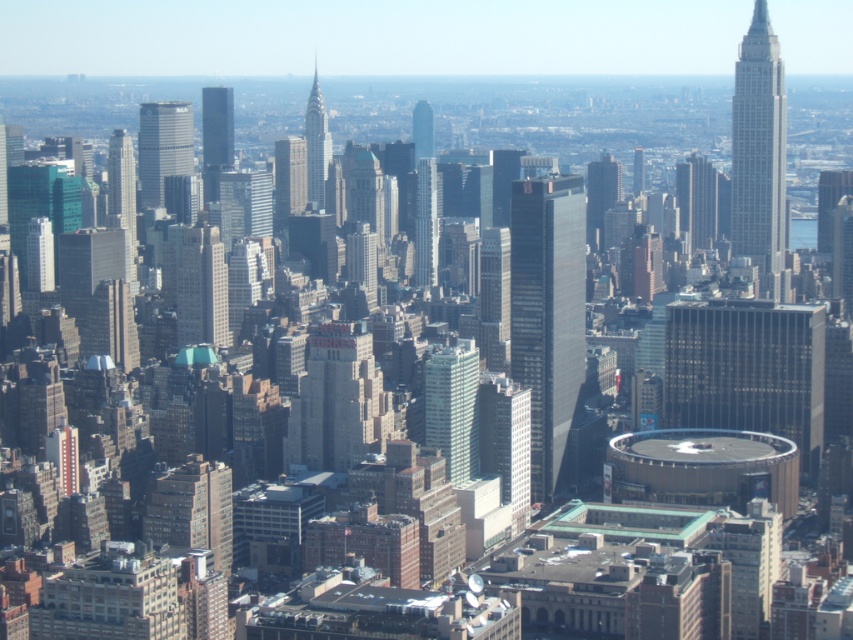
You are a drone operator planning to fly a drone from the green glass skyscraper at center to the shiny silver spire at center. Based on the cityscape view, which direction should you fly the drone to reach the spire?

The green glass skyscraper at center is in front of the shiny silver spire at center, so you should fly the drone backward to reach the shiny silver spire at center.